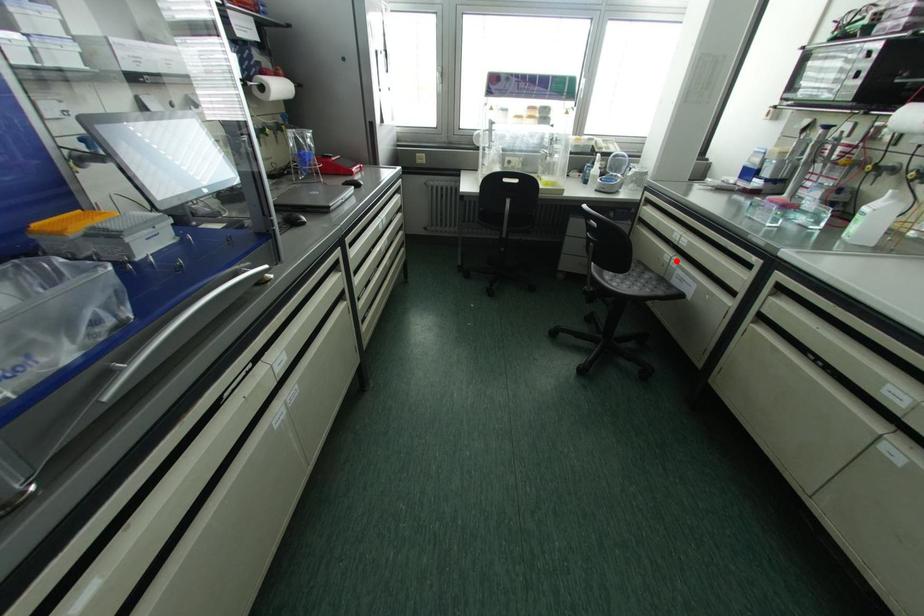
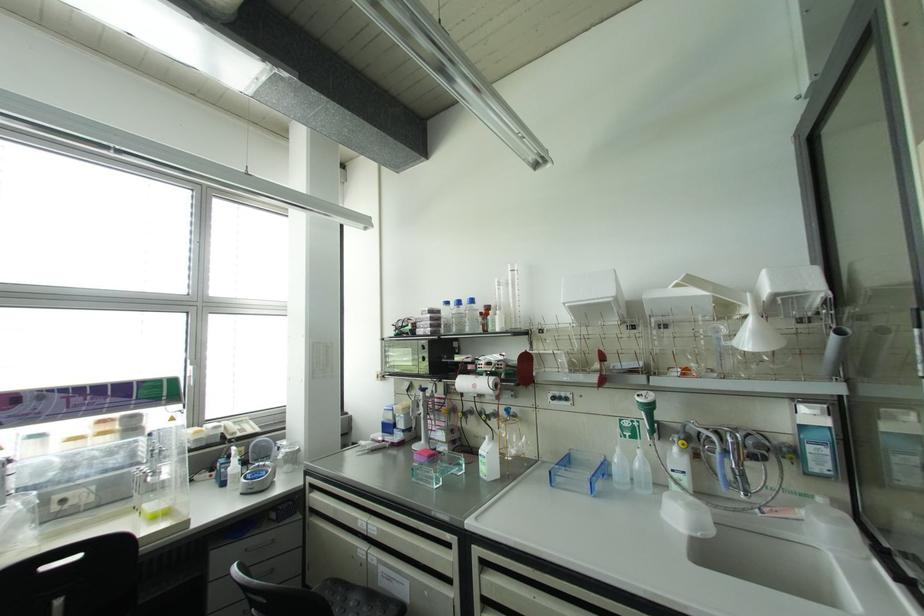
Question: I am providing you with two images of the same scene from different viewpoints. In image1, a red point is highlighted. Considering the same 3D point in image2, which of the following is correct?

Choices:
 (A) It is closer
 (B) It is farther

Answer: (B)